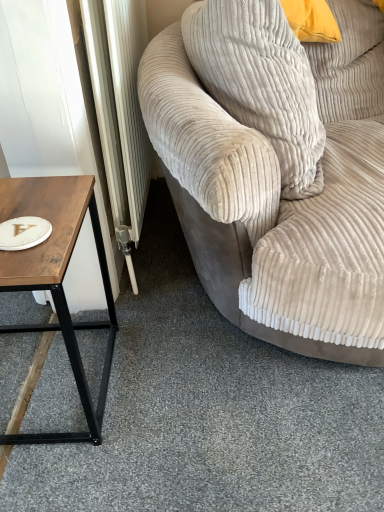
Describe the element at coordinates (57, 280) in the screenshot. I see `wooden table at left` at that location.

Image resolution: width=384 pixels, height=512 pixels. Describe the element at coordinates (23, 233) in the screenshot. I see `white matte paper plate at left` at that location.

Where is `wooden table at left`? wooden table at left is located at coordinates (57, 280).

Is beige corduroy couch at right oriented towards wooden table at left?

No.

Considering the sizes of objects beige corduroy couch at right and wooden table at left in the image provided, who is bigger, beige corduroy couch at right or wooden table at left?

beige corduroy couch at right is bigger.

Considering the positions of objects beige corduroy couch at right and wooden table at left in the image provided, who is more to the left, beige corduroy couch at right or wooden table at left?

wooden table at left.

Considering the sizes of objects beige corduroy couch at right and wooden table at left in the image provided, who is shorter, beige corduroy couch at right or wooden table at left?

Standing shorter between the two is wooden table at left.

From a real-world perspective, who is located higher, white matte paper plate at left or beige corduroy couch at right?

white matte paper plate at left.

Is white matte paper plate at left directly adjacent to beige corduroy couch at right?

No, white matte paper plate at left is not next to beige corduroy couch at right.

Is white matte paper plate at left wider than beige corduroy couch at right?

In fact, white matte paper plate at left might be narrower than beige corduroy couch at right.

Considering the sizes of objects white matte paper plate at left and beige corduroy couch at right in the image provided, who is bigger, white matte paper plate at left or beige corduroy couch at right?

beige corduroy couch at right.

Is white matte paper plate at left located outside beige corduroy pillow at upper right?

white matte paper plate at left is positioned outside beige corduroy pillow at upper right.

Considering the points (23, 242) and (210, 31), which point is in front, point (23, 242) or point (210, 31)?

The point (23, 242) is closer.

You are a GUI agent. You are given a task and a screenshot of the screen. Output one action in this format:
    pyautogui.click(x=<x>, y=<y>)
    Task: Click on the paper plate on the left side of beige corduroy pillow at upper right
    The width and height of the screenshot is (384, 512).
    Given the screenshot: What is the action you would take?
    pyautogui.click(x=23, y=233)

Does white matte paper plate at left lie behind beige corduroy pillow at upper right?

That is True.

Consider the image. From a real-world perspective, is beige corduroy pillow at upper right located higher than beige corduroy couch at right?

Indeed, from a real-world perspective, beige corduroy pillow at upper right stands above beige corduroy couch at right.

Is beige corduroy pillow at upper right turned away from beige corduroy couch at right?

→ Yes, beige corduroy pillow at upper right is facing away from beige corduroy couch at right.

Which of these two, beige corduroy couch at right or beige corduroy pillow at upper right, stands taller?

beige corduroy couch at right.

Can you confirm if beige corduroy couch at right is wider than beige corduroy pillow at upper right?

Correct, the width of beige corduroy couch at right exceeds that of beige corduroy pillow at upper right.

In the scene shown: Can you see beige corduroy couch at right touching beige corduroy pillow at upper right?

No, beige corduroy couch at right is not next to beige corduroy pillow at upper right.

From a real-world perspective, is white matte paper plate at left on wooden table at left?

Yes, from a real-world perspective, white matte paper plate at left is on top of wooden table at left.

Considering the sizes of objects white matte paper plate at left and wooden table at left in the image provided, who is shorter, white matte paper plate at left or wooden table at left?

Standing shorter between the two is white matte paper plate at left.

The image size is (384, 512). Identify the location of coffee table lying below the white matte paper plate at left (from the image's perspective). (x=57, y=280).

Which is nearer, (25, 246) or (101, 403)?

The point (25, 246) is closer.

From their relative heights in the image, would you say wooden table at left is taller or shorter than beige corduroy couch at right?

wooden table at left is shorter than beige corduroy couch at right.

Between wooden table at left and beige corduroy couch at right, which one has smaller size?

wooden table at left.

From the image's perspective, is wooden table at left above or below beige corduroy couch at right?

wooden table at left is situated lower than beige corduroy couch at right in the image.

Is wooden table at left far away from beige corduroy couch at right?

No, wooden table at left is in close proximity to beige corduroy couch at right.

Image resolution: width=384 pixels, height=512 pixels. I want to click on coffee table beneath the beige corduroy couch at right (from a real-world perspective), so click(x=57, y=280).

This screenshot has height=512, width=384. Find the location of `studio couch on the right of white matte paper plate at left`. studio couch on the right of white matte paper plate at left is located at coordinates (281, 194).

From the image, which object appears to be farther from beige corduroy couch at right, white matte paper plate at left or beige corduroy pillow at upper right?

Among the two, white matte paper plate at left is located further to beige corduroy couch at right.

Which object lies nearer to the anchor point beige corduroy pillow at upper right, white matte paper plate at left or wooden table at left?

Based on the image, wooden table at left appears to be nearer to beige corduroy pillow at upper right.

Estimate the real-world distances between objects in this image. Which object is further from white matte paper plate at left, beige corduroy couch at right or wooden table at left?

beige corduroy couch at right is positioned further to the anchor white matte paper plate at left.

Considering their positions, is beige corduroy couch at right positioned closer to wooden table at left than white matte paper plate at left?

Among the two, white matte paper plate at left is located nearer to wooden table at left.

Based on their spatial positions, is white matte paper plate at left or beige corduroy couch at right closer to beige corduroy pillow at upper right?

The object closer to beige corduroy pillow at upper right is beige corduroy couch at right.

Considering their positions, is beige corduroy couch at right positioned further to white matte paper plate at left than beige corduroy pillow at upper right?

beige corduroy couch at right lies further to white matte paper plate at left than the other object.

Which object lies nearer to the anchor point beige corduroy couch at right, white matte paper plate at left or wooden table at left?

wooden table at left lies closer to beige corduroy couch at right than the other object.

Based on their spatial positions, is wooden table at left or beige corduroy couch at right closer to beige corduroy pillow at upper right?

The object closer to beige corduroy pillow at upper right is beige corduroy couch at right.

What are the coordinates of `paper plate between wooden table at left and beige corduroy couch at right` in the screenshot? It's located at (23, 233).

Locate an element on the screen. pillow situated between white matte paper plate at left and beige corduroy couch at right from left to right is located at coordinates (261, 82).

The image size is (384, 512). Identify the location of paper plate between beige corduroy pillow at upper right and wooden table at left vertically. (23, 233).

This screenshot has height=512, width=384. I want to click on pillow located between wooden table at left and beige corduroy couch at right in the left-right direction, so click(261, 82).